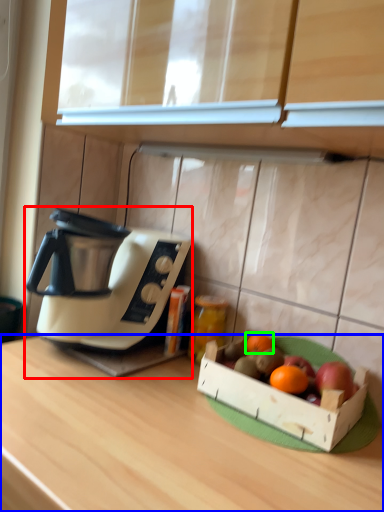
Question: Considering the real-world distances, which object is farthest from coffee maker (highlighted by a red box)? desk (highlighted by a blue box) or grapefruit (highlighted by a green box)?

Choices:
 (A) desk
 (B) grapefruit

Answer: (B)